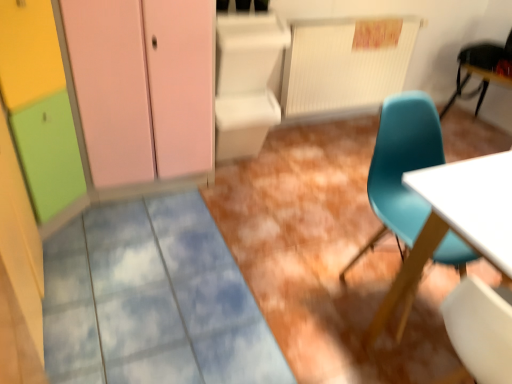
Find the location of `free location in front of matte pink cabinet at upper left`. free location in front of matte pink cabinet at upper left is located at coordinates (147, 240).